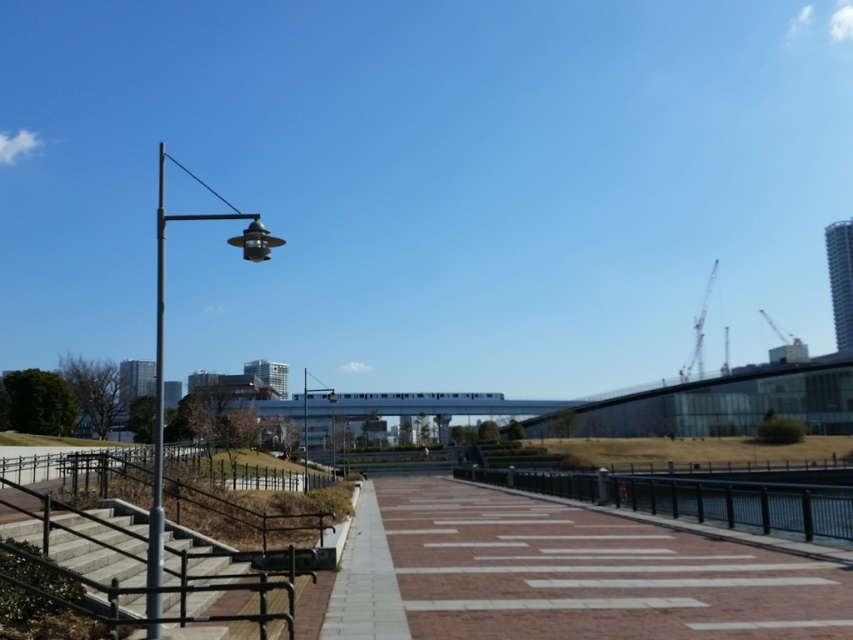
You are standing at the bottom of the concrete stairs at lower left and want to walk to the streetlamp on the left side of the frame. Which direction should you face to walk towards the streetlamp?

You should face towards the left side of the frame to walk towards the streetlamp since the concrete stairs at lower left are located at point (94, 560), which is to the lower left of the streetlamp.

You are standing at the viewpoint of the image and want to reach the point marked as point (134, 544). If your walking speed is 1.2 meters per second, how long will it take you to reach that point?

The point (134, 544) is 9.21 meters from the viewer. At a walking speed of 1.2 meters per second, it will take approximately 7.68 seconds to reach the point.